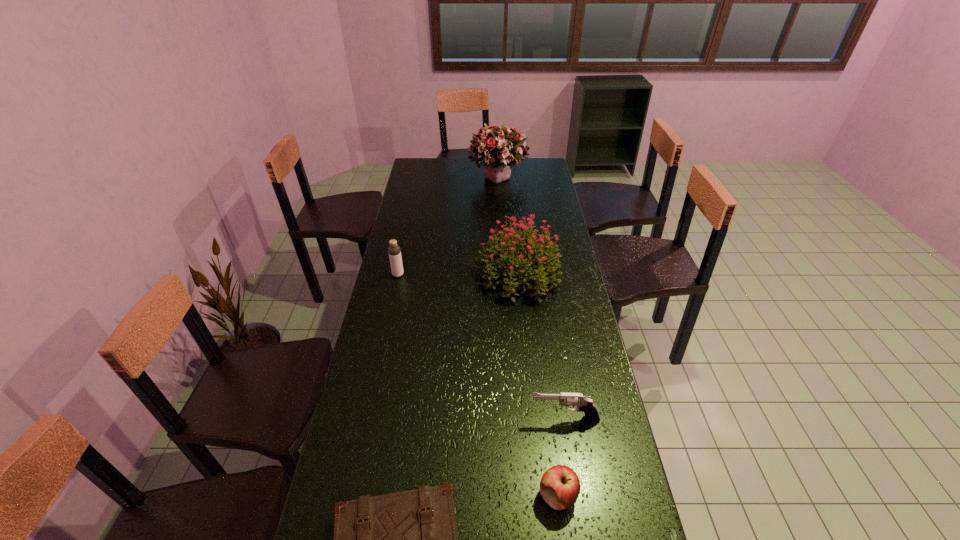
At what (x,y) coordinates should I click in order to perform the action: click on vacant point that satisfies the following two spatial constraints: 1. at the muzzle of the third nearest object; 2. on the front side of the second shortest object. Please return your answer as a coordinate pair (x, y). Looking at the image, I should click on coord(576,496).